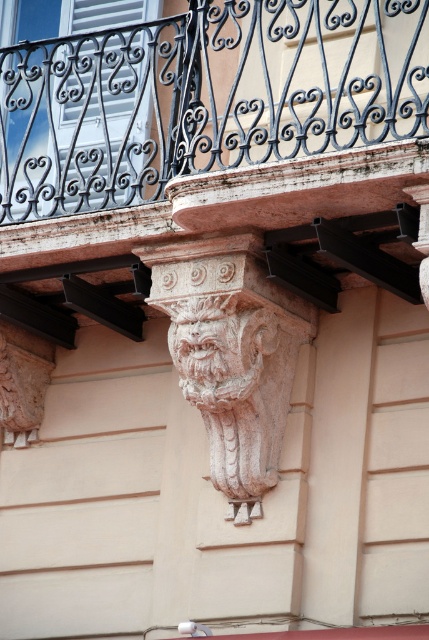
Question: Is rustic stone balcony at center thinner than carved stone lion at center?

Choices:
 (A) no
 (B) yes

Answer: (A)

Question: Is rustic stone balcony at center to the right of carved stone lion at center from the viewer's perspective?

Choices:
 (A) yes
 (B) no

Answer: (B)

Question: Does rustic stone balcony at center have a lesser width compared to carved stone lion at center?

Choices:
 (A) no
 (B) yes

Answer: (A)

Question: Which point is closer to the camera taking this photo?

Choices:
 (A) (259, 246)
 (B) (365, 132)

Answer: (B)